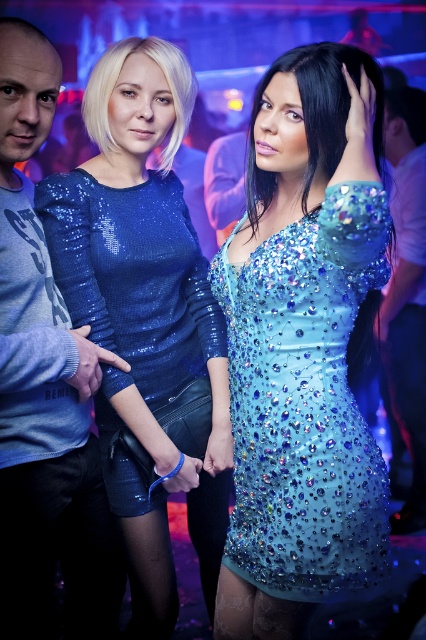
In the scene shown: You are a photographer at the nightclub scene. You need to take a photo of the light blue sweatshirt at left and the white glossy shirt at right. Which one will be more visible in the photo?

The light blue sweatshirt at left will be more visible in the photo because it is in front of the white glossy shirt at right.

You are a photographer at the nightclub. You want to capture a photo where the light blue sweatshirt at left is visible above the white glossy shirt at right. Is this possible with the current arrangement?

The light blue sweatshirt at left is positioned under the white glossy shirt at right, so it cannot be visible above it in the current arrangement.